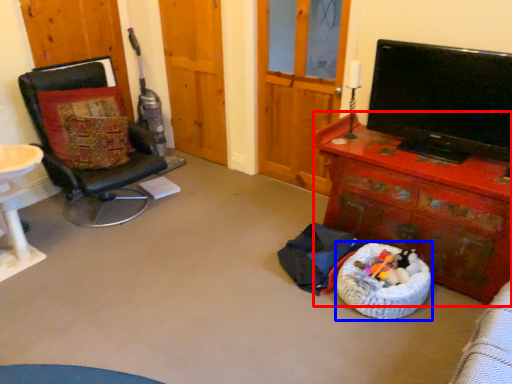
Question: Which of the following is the farthest to the observer, desk (highlighted by a red box) or dog bed (highlighted by a blue box)?

Choices:
 (A) desk
 (B) dog bed

Answer: (B)